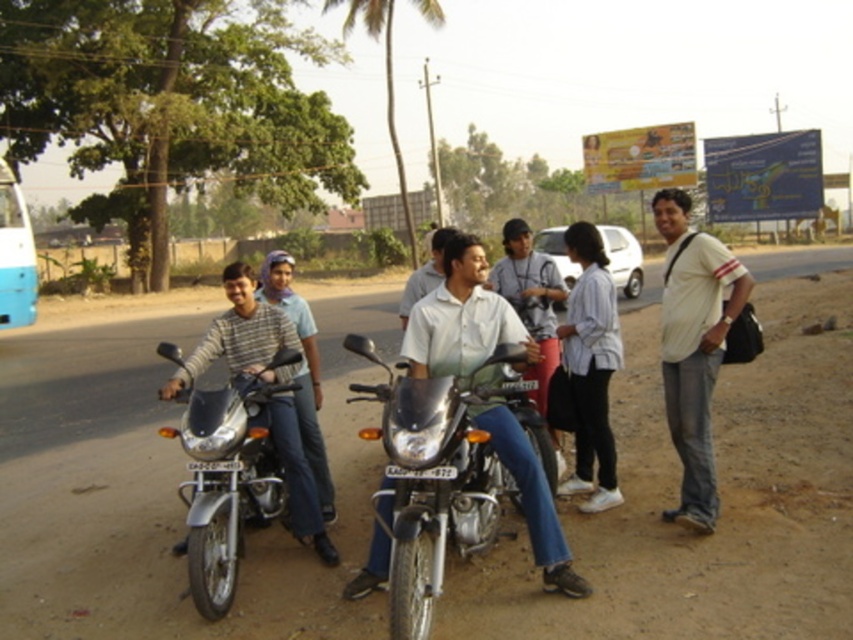
Is point (213, 598) behind point (502, 257)?

No, (213, 598) is in front of (502, 257).

Which is more to the left, shiny metallic motorcycle at left or matte silver motorcycle at center?

shiny metallic motorcycle at left

Between point (252, 424) and point (558, 289), which one is positioned behind?

The point (558, 289) is behind.

The width and height of the screenshot is (853, 640). What are the coordinates of `shiny metallic motorcycle at left` in the screenshot? It's located at (225, 477).

Can you confirm if white striped shirt at right is wider than matte silver motorcycle at center?

Yes.

Is point (662, 324) positioned behind point (486, 282)?

No, (662, 324) is closer to viewer.

I want to click on white striped shirt at right, so click(x=693, y=346).

Image resolution: width=853 pixels, height=640 pixels. In order to click on white striped shirt at right in this screenshot , I will do `click(693, 346)`.

Can you confirm if matte silver motorcycle at center is smaller than light blue shirt at center?

Correct, matte silver motorcycle at center occupies less space than light blue shirt at center.

Is matte silver motorcycle at center thinner than light blue shirt at center?

Indeed, matte silver motorcycle at center has a lesser width compared to light blue shirt at center.

Which is in front, point (544, 269) or point (418, 291)?

Point (418, 291) is more forward.

Find the location of `matte silver motorcycle at center`. matte silver motorcycle at center is located at coordinates (531, 300).